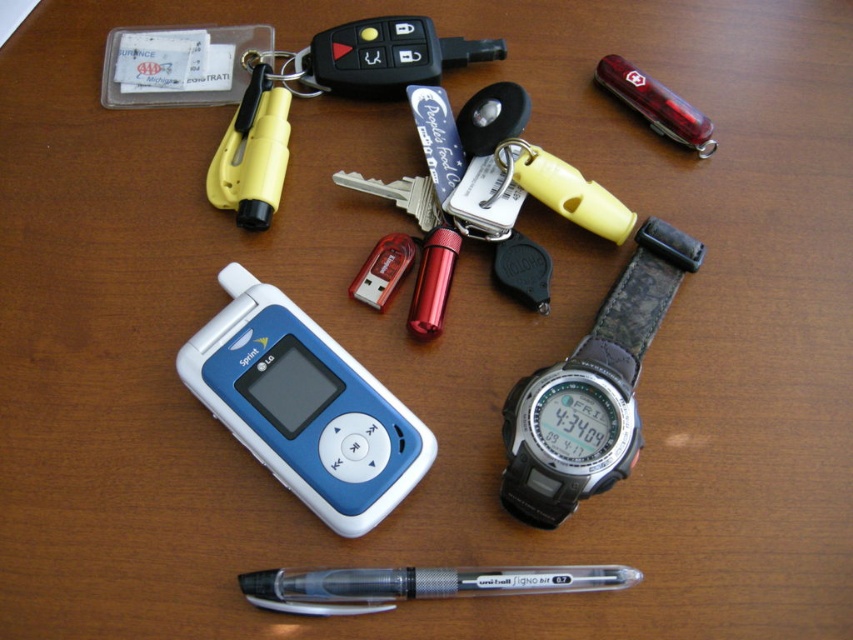
Question: Is blue plastic phone at center bigger than yellow plastic keychain at upper center?

Choices:
 (A) no
 (B) yes

Answer: (A)

Question: Is blue plastic phone at center closer to the viewer compared to transparent plastic pen at lower center?

Choices:
 (A) no
 (B) yes

Answer: (A)

Question: Based on their relative distances, which object is farther from the yellow plastic keychain at upper center?

Choices:
 (A) blue plastic phone at center
 (B) transparent plastic pen at lower center
 (C) black rubber watch at center-right

Answer: (B)

Question: Which point is closer to the camera?

Choices:
 (A) (583, 465)
 (B) (219, 192)
 (C) (271, 445)

Answer: (A)

Question: Does blue plastic phone at center appear on the right side of yellow plastic keychain at upper center?

Choices:
 (A) no
 (B) yes

Answer: (A)

Question: Among these points, which one is nearest to the camera?

Choices:
 (A) (306, 388)
 (B) (254, 148)
 (C) (573, 362)

Answer: (C)